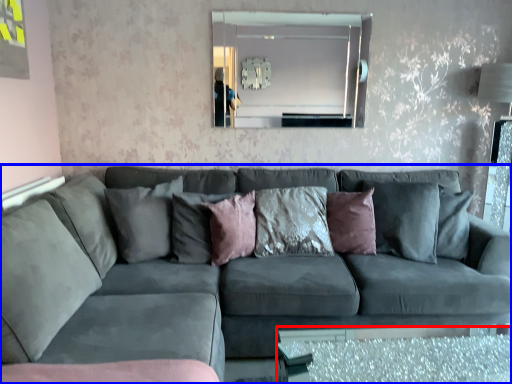
Question: Which point is further to the camera, glass table (highlighted by a red box) or studio couch (highlighted by a blue box)?

Choices:
 (A) glass table
 (B) studio couch

Answer: (A)